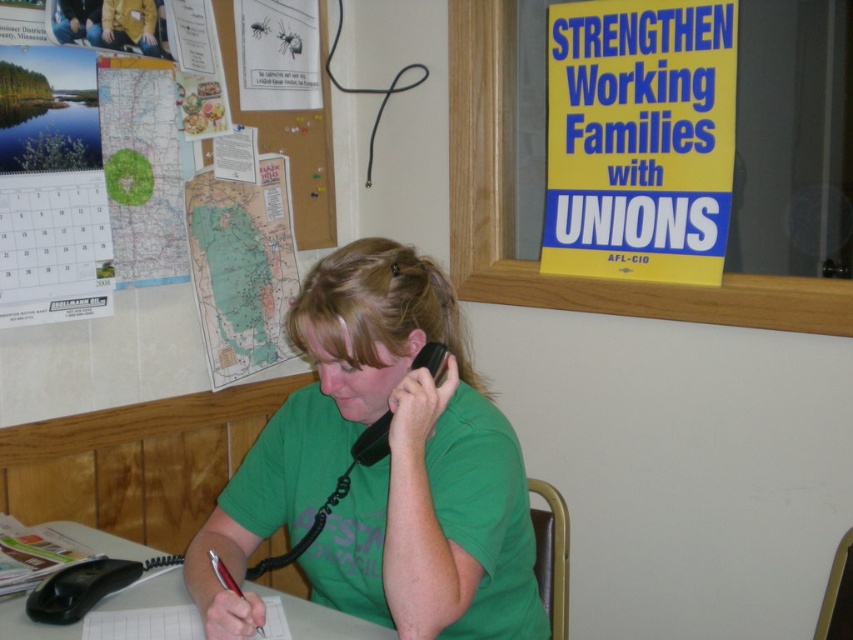
Question: Is yellow paper poster at upper right in front of white paper at center?

Choices:
 (A) yes
 (B) no

Answer: (B)

Question: Among these points, which one is farthest from the camera?

Choices:
 (A) (311, 424)
 (B) (67, 522)
 (C) (376, 444)
 (D) (639, 141)

Answer: (D)

Question: Which object is the farthest from the green matte shirt at center?

Choices:
 (A) green map at upper left
 (B) matte black phone at upper left

Answer: (B)

Question: Where is white paper at center located in relation to matte black phone at upper left in the image?

Choices:
 (A) below
 (B) above

Answer: (A)

Question: Which point appears farthest from the camera in this image?

Choices:
 (A) (47, 364)
 (B) (422, 381)

Answer: (A)

Question: Is green matte shirt at center to the right of green map at upper left from the viewer's perspective?

Choices:
 (A) no
 (B) yes

Answer: (B)